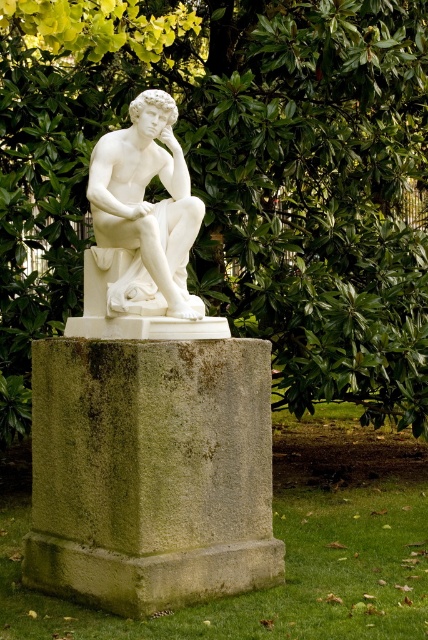
You are standing in a garden and want to take a photo of the classical marble statue of a seated male figure. The statue is located at point (5,314). If your camera has a maximum focus range of 12 meters, will you be able to focus on the statue from your current position?

The distance between point (5,314) and the viewer is 11.88 meters, which is within the camera maximum focus range of 12 meters. So yes, the camera can focus on the statue.

From the picture: You are standing in a garden and see the green stone pedestal at center with a marble statue on top. If you want to touch the pedestal, how many steps do you need to take if each step covers 0.7 meters?

The green stone pedestal at center is 7.92 meters away from the viewer. Dividing the distance by the step length of 0.7 meters gives approximately 11.31 steps. Since you can only take whole steps, you would need to take 12 steps to reach the pedestal.

Looking at this image, you are an artist planning to paint the scene. You need to decide which object, the green leafy tree at upper center or the green stone pedestal at center, requires more detailed brushstrokes due to its smaller size. Which one should you focus on?

The green leafy tree at upper center requires more detailed brushstrokes because its width is smaller than the green stone pedestal at center.